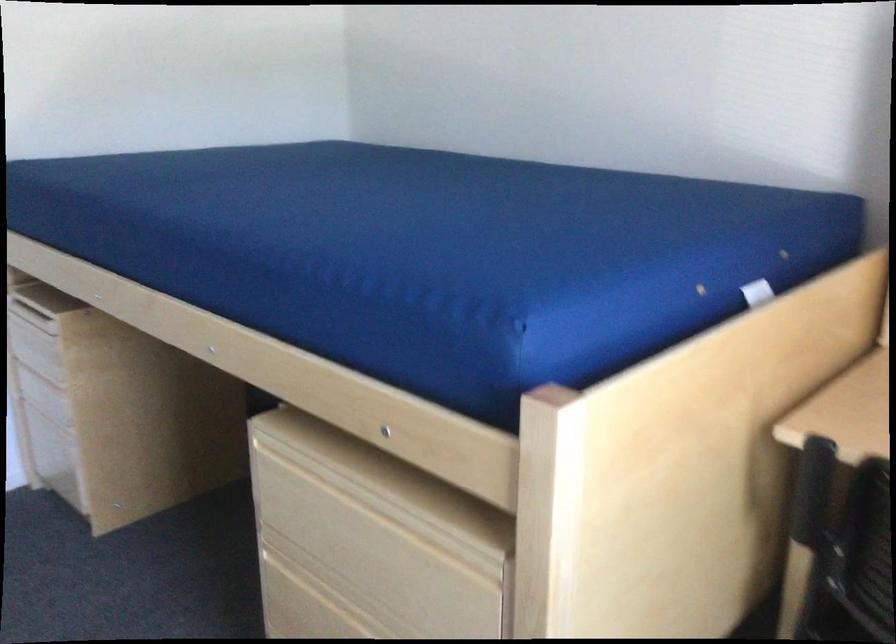
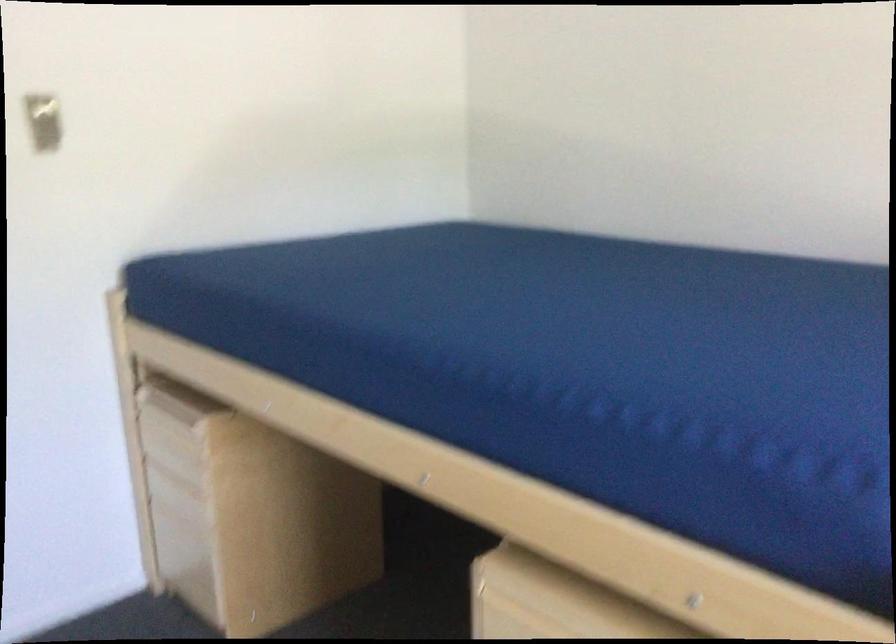
The images are taken continuously from a first-person perspective. In which direction are you moving?

The cameraman walked toward left, forward.